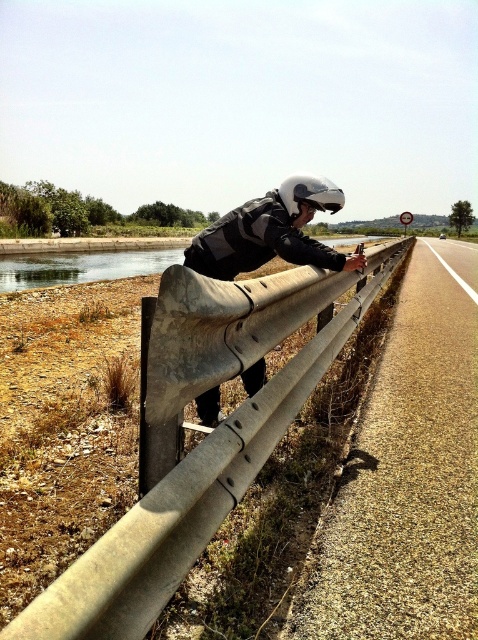
Question: Can you confirm if concrete barrier at center is positioned below white matte helmet at upper center?

Choices:
 (A) no
 (B) yes

Answer: (B)

Question: Among these points, which one is farthest from the camera?

Choices:
 (A) (242, 458)
 (B) (316, 198)

Answer: (B)

Question: Considering the relative positions of concrete barrier at center and white matte helmet at upper center in the image provided, where is concrete barrier at center located with respect to white matte helmet at upper center?

Choices:
 (A) left
 (B) right

Answer: (B)

Question: Does concrete barrier at center appear over white matte helmet at upper center?

Choices:
 (A) yes
 (B) no

Answer: (B)

Question: Among these objects, which one is farthest from the camera?

Choices:
 (A) concrete barrier at center
 (B) white matte helmet at upper center

Answer: (B)